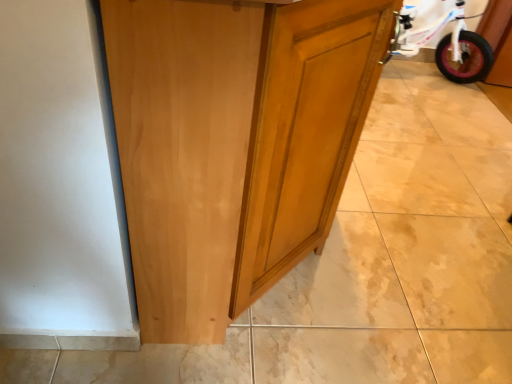
Where is `vacant space underneath pink rubber tire at right (from a real-world perspective)`? This screenshot has height=384, width=512. vacant space underneath pink rubber tire at right (from a real-world perspective) is located at coordinates (439, 86).